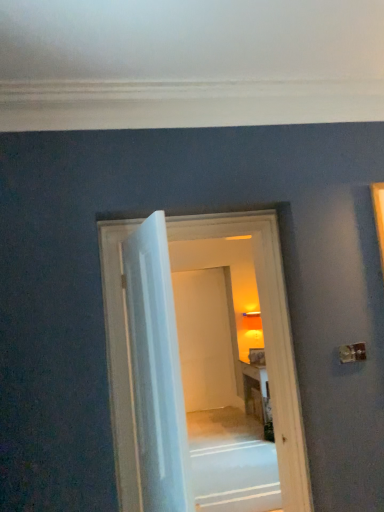
What is the approximate height of white glossy door at center, marked as the first door in a front-to-back arrangement?

The height of white glossy door at center, marked as the first door in a front-to-back arrangement, is 1.41 meters.

Identify the location of white glossy door at center, marked as the first door in a front-to-back arrangement. This screenshot has height=512, width=384. (156, 370).

Describe the element at coordinates (156, 370) in the screenshot. Image resolution: width=384 pixels, height=512 pixels. I see `white glossy door at center, arranged as the 2th door when viewed from the back` at that location.

What do you see at coordinates (263, 331) in the screenshot? I see `white wooden door at center, the second door positioned from the front` at bounding box center [263, 331].

At what (x,y) coordinates should I click in order to perform the action: click on white wooden door at center, the first door from the back. Please return your answer as a coordinate pair (x, y). Looking at the image, I should click on (263, 331).

This screenshot has height=512, width=384. I want to click on white glossy door at center, arranged as the 2th door when viewed from the back, so click(156, 370).

Which object is positioned more to the right, white glossy door at center, arranged as the 2th door when viewed from the back, or white wooden door at center, the first door from the back?

white wooden door at center, the first door from the back, is more to the right.

In the image, is white glossy door at center, marked as the first door in a front-to-back arrangement, positioned in front of or behind white wooden door at center, the first door from the back?

Clearly, white glossy door at center, marked as the first door in a front-to-back arrangement, is in front of white wooden door at center, the first door from the back.

Between point (147, 317) and point (136, 441), which one is positioned in front?

Point (147, 317)

Looking at this image, from the image's perspective, would you say white glossy door at center, marked as the first door in a front-to-back arrangement, is shown under white wooden door at center, the first door from the back?

No, from the image's perspective, white glossy door at center, marked as the first door in a front-to-back arrangement, is not beneath white wooden door at center, the first door from the back.

From a real-world perspective, is white glossy door at center, arranged as the 2th door when viewed from the back, above or below white wooden door at center, the first door from the back?

Clearly, from a real-world perspective, white glossy door at center, arranged as the 2th door when viewed from the back, is above white wooden door at center, the first door from the back.

Which object is thinner, white glossy door at center, marked as the first door in a front-to-back arrangement, or white wooden door at center, the first door from the back?

white glossy door at center, marked as the first door in a front-to-back arrangement, is thinner.

Which of these two, white glossy door at center, arranged as the 2th door when viewed from the back, or white wooden door at center, the second door positioned from the front, stands shorter?

With less height is white glossy door at center, arranged as the 2th door when viewed from the back.

Between white glossy door at center, arranged as the 2th door when viewed from the back, and white wooden door at center, the first door from the back, which one has larger size?

With larger size is white wooden door at center, the first door from the back.

Looking at this image, does white glossy door at center, arranged as the 2th door when viewed from the back, contain white wooden door at center, the first door from the back?

Definitely not — white wooden door at center, the first door from the back, is not inside white glossy door at center, arranged as the 2th door when viewed from the back.

Is white glossy door at center, marked as the first door in a front-to-back arrangement, touching white wooden door at center, the first door from the back?

No, white glossy door at center, marked as the first door in a front-to-back arrangement, is not touching white wooden door at center, the first door from the back.

Is white glossy door at center, arranged as the 2th door when viewed from the back, positioned with its back to white wooden door at center, the second door positioned from the front?

No, white glossy door at center, arranged as the 2th door when viewed from the back, is not facing the opposite direction of white wooden door at center, the second door positioned from the front.

How many degrees apart are the facing directions of white glossy door at center, arranged as the 2th door when viewed from the back, and white wooden door at center, the first door from the back?

There is a 102-degree angle between the facing directions of white glossy door at center, arranged as the 2th door when viewed from the back, and white wooden door at center, the first door from the back.

How far apart are white glossy door at center, marked as the first door in a front-to-back arrangement, and white wooden door at center, the second door positioned from the front?

white glossy door at center, marked as the first door in a front-to-back arrangement, is 15.78 inches from white wooden door at center, the second door positioned from the front.

I want to click on door above the white wooden door at center, the first door from the back (from the image's perspective), so click(156, 370).

Which object is positioned more to the right, white wooden door at center, the first door from the back, or white glossy door at center, arranged as the 2th door when viewed from the back?

white wooden door at center, the first door from the back, is more to the right.

Between white wooden door at center, the second door positioned from the front, and white glossy door at center, marked as the first door in a front-to-back arrangement, which one is positioned behind?

white wooden door at center, the second door positioned from the front, is further from the camera.

Between point (282, 335) and point (164, 390), which one is positioned in front?

The point (164, 390) is in front.

From the image's perspective, is white wooden door at center, the second door positioned from the front, located above white glossy door at center, marked as the first door in a front-to-back arrangement?

No, from the image's perspective, white wooden door at center, the second door positioned from the front, is not above white glossy door at center, marked as the first door in a front-to-back arrangement.

From a real-world perspective, is white wooden door at center, the second door positioned from the front, beneath white glossy door at center, marked as the first door in a front-to-back arrangement?

Yes.

Considering the sizes of white wooden door at center, the first door from the back, and white glossy door at center, marked as the first door in a front-to-back arrangement, in the image, is white wooden door at center, the first door from the back, wider or thinner than white glossy door at center, marked as the first door in a front-to-back arrangement,?

In the image, white wooden door at center, the first door from the back, appears to be wider than white glossy door at center, marked as the first door in a front-to-back arrangement.

Is white wooden door at center, the first door from the back, taller or shorter than white glossy door at center, arranged as the 2th door when viewed from the back?

Considering their sizes, white wooden door at center, the first door from the back, has more height than white glossy door at center, arranged as the 2th door when viewed from the back.

Who is bigger, white wooden door at center, the first door from the back, or white glossy door at center, marked as the first door in a front-to-back arrangement?

white wooden door at center, the first door from the back.

Is white glossy door at center, marked as the first door in a front-to-back arrangement, inside white wooden door at center, the first door from the back?

No, white glossy door at center, marked as the first door in a front-to-back arrangement, is not inside white wooden door at center, the first door from the back.

Is white wooden door at center, the first door from the back, with white glossy door at center, arranged as the 2th door when viewed from the back?

white wooden door at center, the first door from the back, and white glossy door at center, arranged as the 2th door when viewed from the back, are clearly separated.

Is white wooden door at center, the first door from the back, facing away from white glossy door at center, marked as the first door in a front-to-back arrangement?

Answer: white wooden door at center, the first door from the back, does not have its back to white glossy door at center, marked as the first door in a front-to-back arrangement.

Can you tell me how much white wooden door at center, the first door from the back, and white glossy door at center, arranged as the 2th door when viewed from the back, differ in facing direction?

There is a 102-degree angle between the facing directions of white wooden door at center, the first door from the back, and white glossy door at center, arranged as the 2th door when viewed from the back.

How much distance is there between white wooden door at center, the second door positioned from the front, and white glossy door at center, arranged as the 2th door when viewed from the back?

They are 15.78 inches apart.

Where is `door in front of the white wooden door at center, the first door from the back`? The image size is (384, 512). door in front of the white wooden door at center, the first door from the back is located at coordinates (156, 370).

This screenshot has height=512, width=384. I want to click on door lying in front of the white wooden door at center, the second door positioned from the front, so click(156, 370).

This screenshot has width=384, height=512. In order to click on door above the white wooden door at center, the first door from the back (from the image's perspective) in this screenshot , I will do pos(156,370).